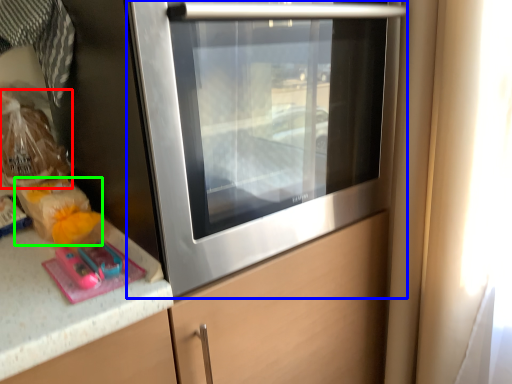
Question: Which object is positioned farthest from food (highlighted by a red box)? Select from home appliance (highlighted by a blue box) and food (highlighted by a green box).

Choices:
 (A) home appliance
 (B) food

Answer: (A)